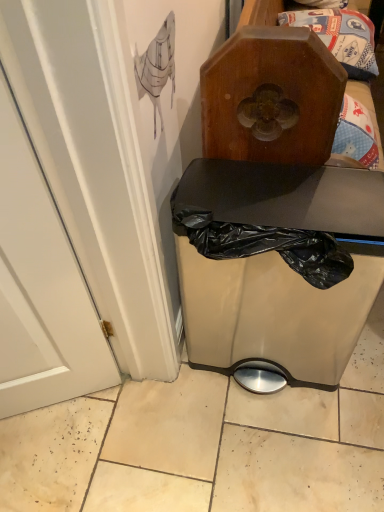
Question: Does matte black trash can at center appear on the left side of wooden box at upper center?

Choices:
 (A) no
 (B) yes

Answer: (A)

Question: Considering the relative sizes of matte black trash can at center and wooden box at upper center in the image provided, is matte black trash can at center wider than wooden box at upper center?

Choices:
 (A) yes
 (B) no

Answer: (A)

Question: Considering the relative sizes of matte black trash can at center and wooden box at upper center in the image provided, is matte black trash can at center shorter than wooden box at upper center?

Choices:
 (A) no
 (B) yes

Answer: (A)

Question: Is matte black trash can at center facing away from wooden box at upper center?

Choices:
 (A) no
 (B) yes

Answer: (B)

Question: Is wooden box at upper center inside matte black trash can at center?

Choices:
 (A) yes
 (B) no

Answer: (A)

Question: Is the position of matte black trash can at center more distant than that of wooden box at upper center?

Choices:
 (A) no
 (B) yes

Answer: (A)

Question: Does wooden box at upper center contain matte black trash can at center?

Choices:
 (A) yes
 (B) no

Answer: (B)

Question: From the image's perspective, would you say wooden box at upper center is shown under matte black trash can at center?

Choices:
 (A) yes
 (B) no

Answer: (A)

Question: Can you confirm if wooden box at upper center is wider than matte black trash can at center?

Choices:
 (A) no
 (B) yes

Answer: (A)

Question: Is wooden box at upper center positioned beyond the bounds of matte black trash can at center?

Choices:
 (A) no
 (B) yes

Answer: (A)

Question: Is wooden box at upper center further to the viewer compared to matte black trash can at center?

Choices:
 (A) yes
 (B) no

Answer: (A)

Question: Is wooden box at upper center closer to the viewer compared to matte black trash can at center?

Choices:
 (A) no
 (B) yes

Answer: (A)

Question: Relative to wooden box at upper center, is matte black trash can at center in front or behind?

Choices:
 (A) front
 (B) behind

Answer: (A)